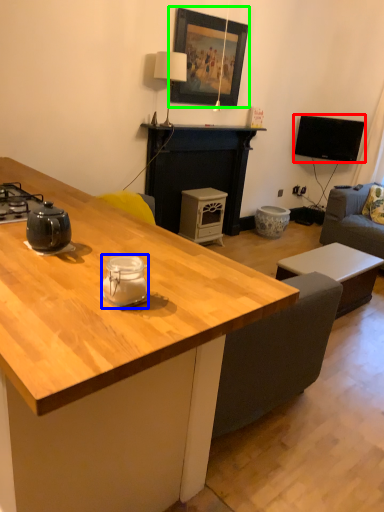
Question: Which object is the farthest from television (highlighted by a red box)? Choose among these: appliance (highlighted by a blue box) or picture frame (highlighted by a green box).

Choices:
 (A) appliance
 (B) picture frame

Answer: (A)